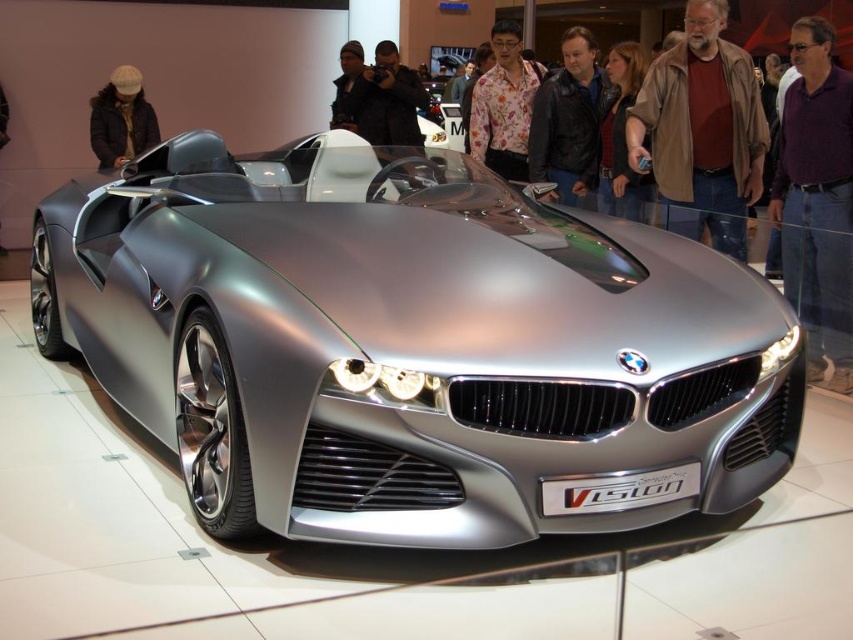
Who is positioned more to the right, satin silver car at center or brown leather jacket at center?

From the viewer's perspective, brown leather jacket at center appears more on the right side.

The image size is (853, 640). Identify the location of satin silver car at center. (413, 346).

What do you see at coordinates (413, 346) in the screenshot? I see `satin silver car at center` at bounding box center [413, 346].

Locate an element on the screen. This screenshot has width=853, height=640. satin silver car at center is located at coordinates (413, 346).

Which is in front, point (360, 440) or point (97, 147)?

Point (360, 440) is more forward.

Between satin silver car at center and knit cap at upper left, which one is positioned higher?

knit cap at upper left

Which is in front, point (691, 360) or point (97, 150)?

Point (691, 360) is more forward.

You are a GUI agent. You are given a task and a screenshot of the screen. Output one action in this format:
    pyautogui.click(x=<x>, y=<y>)
    Task: Click on the satin silver car at center
    The width and height of the screenshot is (853, 640).
    Given the screenshot: What is the action you would take?
    pyautogui.click(x=413, y=346)

Between brown leather jacket at center and floral shirt at center, which one is positioned higher?

floral shirt at center is above.

Between point (721, 70) and point (490, 132), which one is positioned behind?

The point (490, 132) is behind.

Is point (706, 205) less distant than point (498, 141)?

Yes, it is.

Where is `brown leather jacket at center`? Image resolution: width=853 pixels, height=640 pixels. brown leather jacket at center is located at coordinates tap(701, 131).